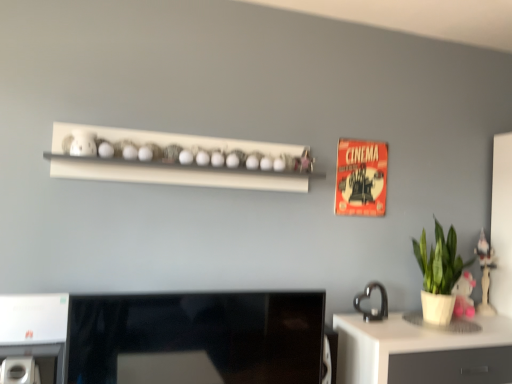
Question: In the image, is green matte plant at right positioned in front of or behind white glossy desk at lower right?

Choices:
 (A) front
 (B) behind

Answer: (B)

Question: Based on their sizes in the image, would you say green matte plant at right is bigger or smaller than white glossy desk at lower right?

Choices:
 (A) small
 (B) big

Answer: (A)

Question: Considering the real-world distances, which object is farthest from the black glossy heart at right, which is the first appliance from right to left?

Choices:
 (A) black glossy desktop at center
 (B) green matte plant at right
 (C) white plastic air conditioner at lower left, which is the 1th appliance from front to back
 (D) white glossy desk at lower right
 (E) wooden figurine at right

Answer: (C)

Question: Estimate the real-world distances between objects in this image. Which object is farther from the white plastic air conditioner at lower left, which is the 2th appliance from back to front?

Choices:
 (A) black glossy heart at right, marked as the 1th appliance in a back-to-front arrangement
 (B) wooden figurine at right
 (C) white glossy desk at lower right
 (D) green matte plant at right
 (E) black glossy desktop at center

Answer: (B)